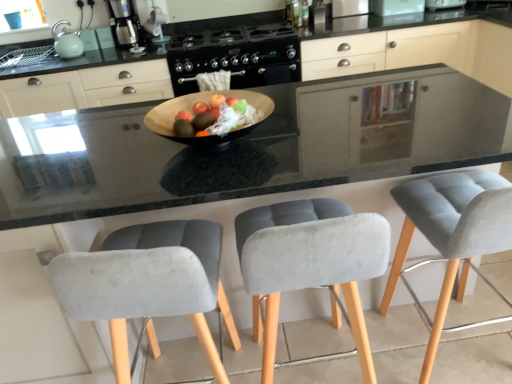
Question: Can you confirm if white glossy coffee maker at upper center, the second appliance positioned from the left, is shorter than black matte gas stove at center?

Choices:
 (A) no
 (B) yes

Answer: (A)

Question: Can black matte gas stove at center be found inside white glossy coffee maker at upper center, the fourth appliance in the right-to-left sequence?

Choices:
 (A) no
 (B) yes

Answer: (A)

Question: Can you confirm if white glossy coffee maker at upper center, the second appliance positioned from the left, is positioned to the left of black matte gas stove at center?

Choices:
 (A) yes
 (B) no

Answer: (A)

Question: Considering the relative sizes of white glossy coffee maker at upper center, the fourth appliance in the right-to-left sequence, and black matte gas stove at center in the image provided, is white glossy coffee maker at upper center, the fourth appliance in the right-to-left sequence, thinner than black matte gas stove at center?

Choices:
 (A) no
 (B) yes

Answer: (B)

Question: Would you say white glossy coffee maker at upper center, the fourth appliance in the right-to-left sequence, is outside black matte gas stove at center?

Choices:
 (A) no
 (B) yes

Answer: (B)

Question: From the image's perspective, is white glossy coffee maker at upper center, the second appliance positioned from the left, beneath black matte gas stove at center?

Choices:
 (A) yes
 (B) no

Answer: (B)

Question: Is brushed metal toaster at upper center, which ranks as the third appliance in left-to-right order, smaller than white glossy coffee maker at upper center, the second appliance positioned from the left?

Choices:
 (A) no
 (B) yes

Answer: (B)

Question: Can you confirm if brushed metal toaster at upper center, which is counted as the 3th appliance, starting from the right, is positioned to the left of white glossy coffee maker at upper center, the second appliance positioned from the left?

Choices:
 (A) no
 (B) yes

Answer: (A)

Question: Is brushed metal toaster at upper center, which ranks as the third appliance in left-to-right order, not near white glossy coffee maker at upper center, the second appliance positioned from the left?

Choices:
 (A) no
 (B) yes

Answer: (B)

Question: From the image's perspective, does brushed metal toaster at upper center, which is counted as the 3th appliance, starting from the right, appear higher than white glossy coffee maker at upper center, the fourth appliance in the right-to-left sequence?

Choices:
 (A) yes
 (B) no

Answer: (A)

Question: Does brushed metal toaster at upper center, which ranks as the third appliance in left-to-right order, come behind white glossy coffee maker at upper center, the second appliance positioned from the left?

Choices:
 (A) yes
 (B) no

Answer: (A)

Question: Is brushed metal toaster at upper center, which ranks as the third appliance in left-to-right order, to the right of white glossy coffee maker at upper center, the fourth appliance in the right-to-left sequence, from the viewer's perspective?

Choices:
 (A) no
 (B) yes

Answer: (B)

Question: Considering the relative sizes of brushed metal toaster at upper center, which is counted as the 3th appliance, starting from the right, and gray fabric chair at center, the 3th chair viewed from the right, in the image provided, is brushed metal toaster at upper center, which is counted as the 3th appliance, starting from the right, thinner than gray fabric chair at center, the 3th chair viewed from the right,?

Choices:
 (A) yes
 (B) no

Answer: (A)